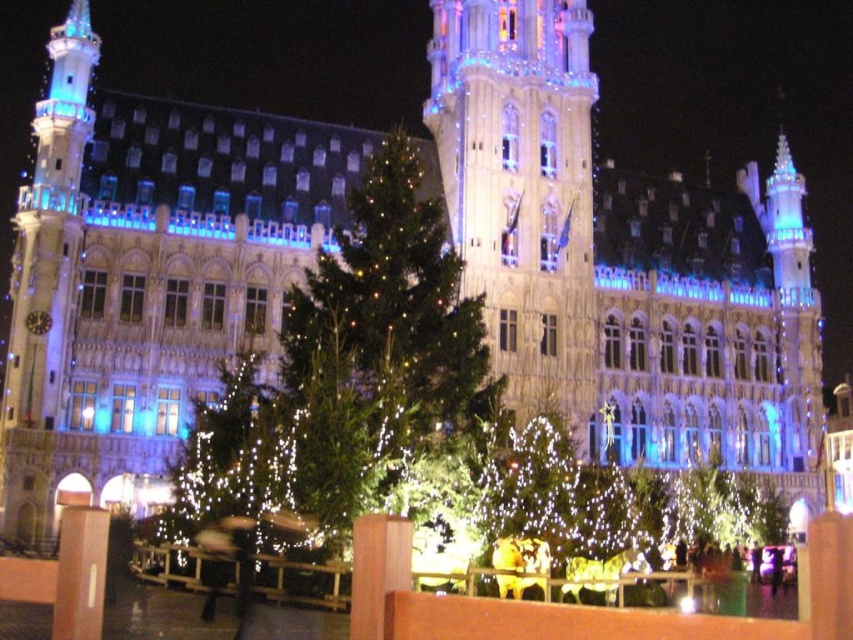
Question: Does illuminated stone tower at center appear on the left side of green matte tree at center?

Choices:
 (A) no
 (B) yes

Answer: (A)

Question: Which point is closer to the camera?

Choices:
 (A) illuminated stone tower at center
 (B) green matte tree at center

Answer: (B)

Question: Does illuminated stone tower at center lie in front of green matte tree at center?

Choices:
 (A) yes
 (B) no

Answer: (B)

Question: Does illuminated stone tower at center have a greater width compared to green matte tree at center?

Choices:
 (A) no
 (B) yes

Answer: (A)

Question: Which point is farther from the camera taking this photo?

Choices:
 (A) (566, 64)
 (B) (482, 397)

Answer: (A)